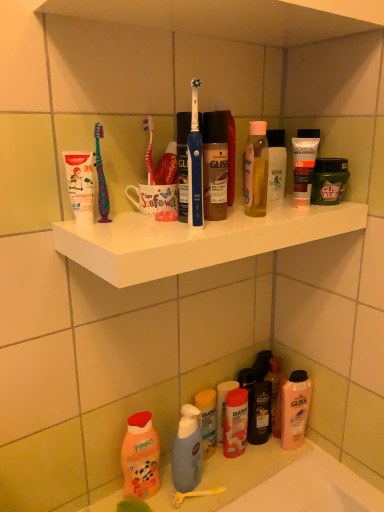
Where is `free space in front of matte orange lotion at lower center, the second toiletry in the bottom-to-top sequence`? free space in front of matte orange lotion at lower center, the second toiletry in the bottom-to-top sequence is located at coordinates (235, 476).